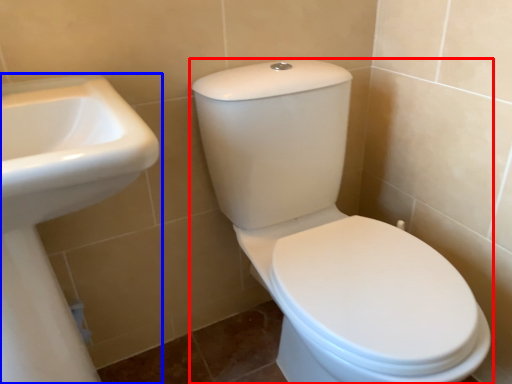
Question: Which object is closer to the camera taking this photo, toilet (highlighted by a red box) or sink (highlighted by a blue box)?

Choices:
 (A) toilet
 (B) sink

Answer: (B)